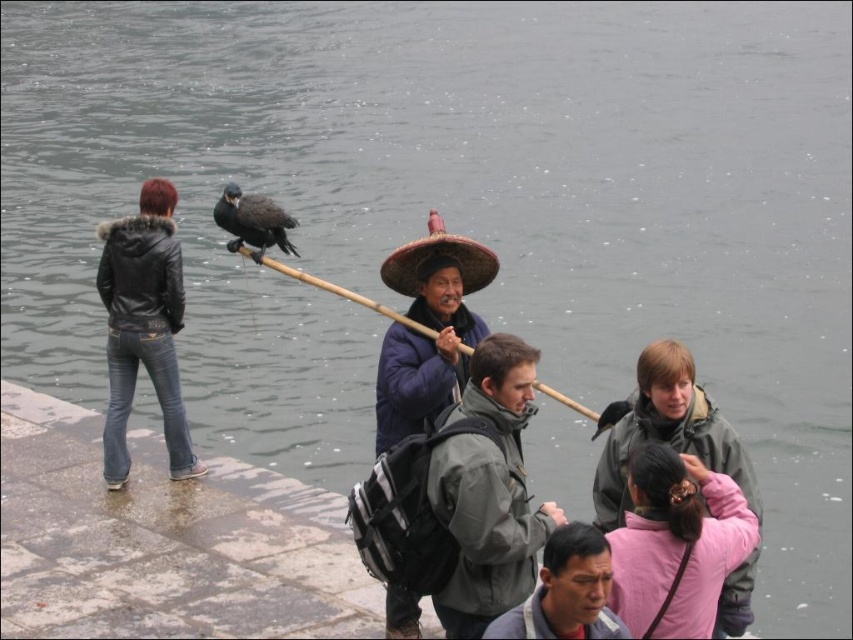
Between point (503, 419) and point (633, 561), which one is positioned in front?

Point (633, 561) is in front.

How distant is gray matte jacket at center from pink fabric hairband at lower right?

gray matte jacket at center is 2.83 meters from pink fabric hairband at lower right.

Is point (508, 496) farther from camera compared to point (711, 504)?

Yes.

Image resolution: width=853 pixels, height=640 pixels. In order to click on gray matte jacket at center in this screenshot , I will do `click(489, 492)`.

Between black leather jacket at left and bamboo stick at center, which one is positioned lower?

Positioned lower is bamboo stick at center.

You are a GUI agent. You are given a task and a screenshot of the screen. Output one action in this format:
    pyautogui.click(x=<x>, y=<y>)
    Task: Click on the black leather jacket at left
    This screenshot has height=640, width=853.
    Given the screenshot: What is the action you would take?
    pos(143,326)

This screenshot has width=853, height=640. In order to click on black leather jacket at left in this screenshot , I will do `click(143, 326)`.

Identify the location of black leather jacket at left. This screenshot has width=853, height=640. (143, 326).

Which is in front, point (107, 321) or point (578, 545)?

Point (578, 545) is more forward.

I want to click on black leather jacket at left, so click(143, 326).